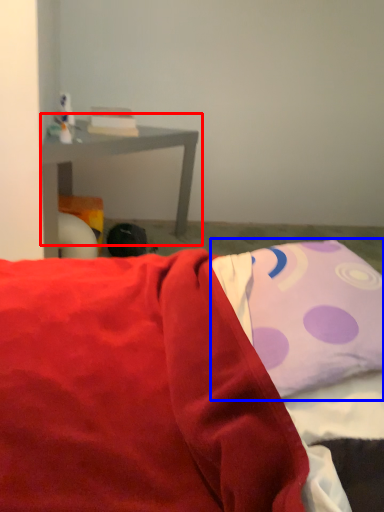
Question: Which point is closer to the camera, table (highlighted by a red box) or pillow (highlighted by a blue box)?

Choices:
 (A) table
 (B) pillow

Answer: (B)